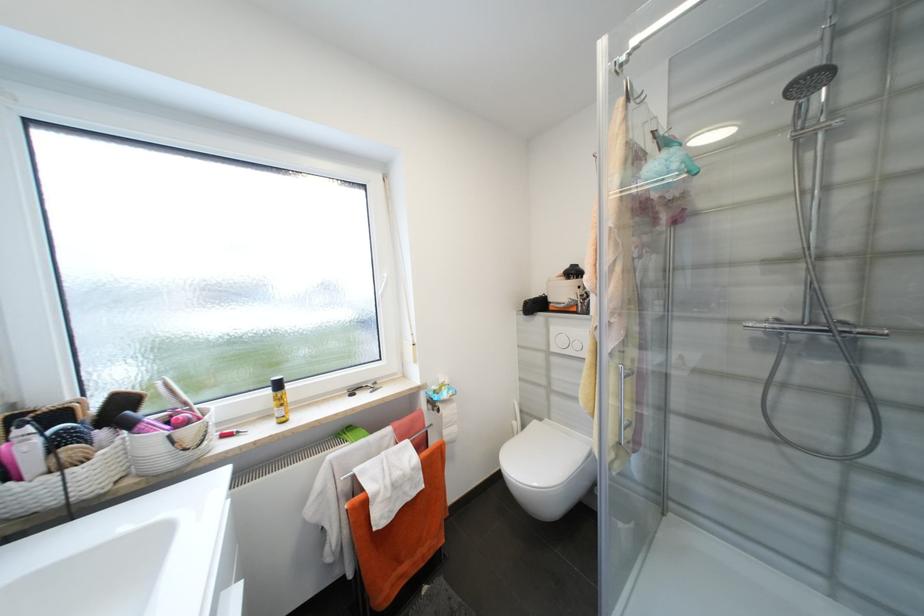
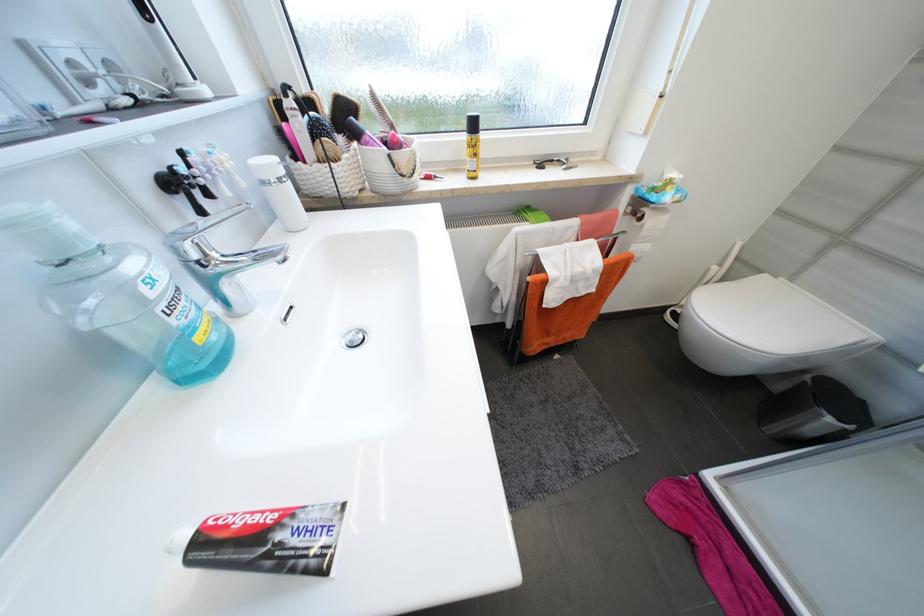
Find the pixel in the second image that matches [134,427] in the first image.

(362, 136)